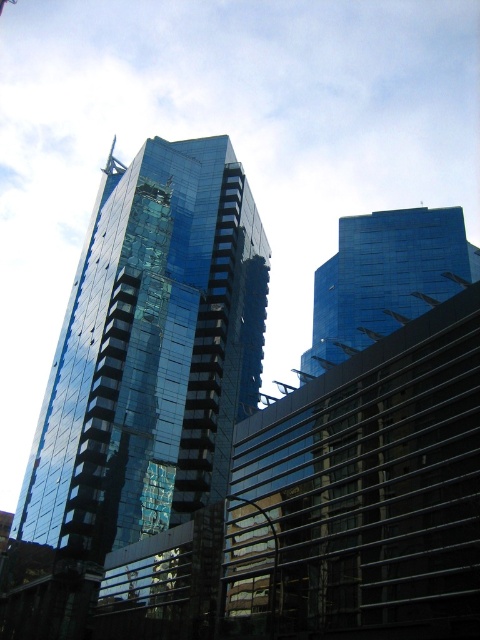
You are standing at the base of the taller skyscraper and want to take a photo of the point at coordinates point (61, 577). Given that your camera has a maximum zoom range of 60 meters, will you be able to capture that point clearly in your photo?

The point (61, 577) is 66.71 meters away from the camera. Since the camera can only zoom up to 60 meters, it won t be able to capture the point clearly at that distance.

Consider the image. You are standing at the point indicated by the coordinates point (140, 376) in the image. What is the closest object to you?

The closest object to you at point (140, 376) is the glossy glass building at center, as the coordinates directly indicate its location.

You are standing at the camera position and want to take a photo of the glossy glass building at center. If your camera has a maximum focus range of 60 meters, will you be able to capture the building clearly?

The glossy glass building at center and camera are 65.39 meters apart from each other. Since the distance exceeds the camera maximum focus range of 60 meters, the building will be out of focus and not captured clearly.